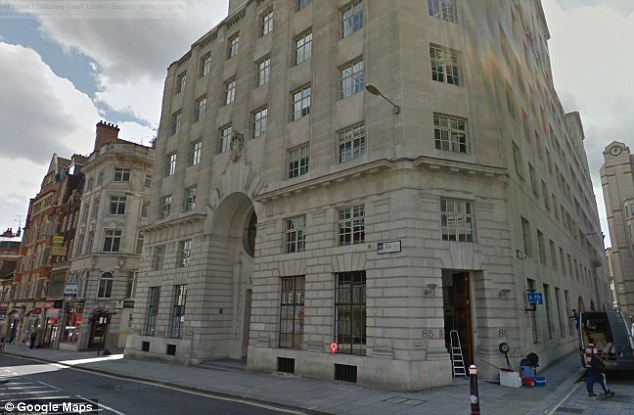
The width and height of the screenshot is (634, 415). In order to click on archway in this screenshot , I will do `click(227, 219)`.